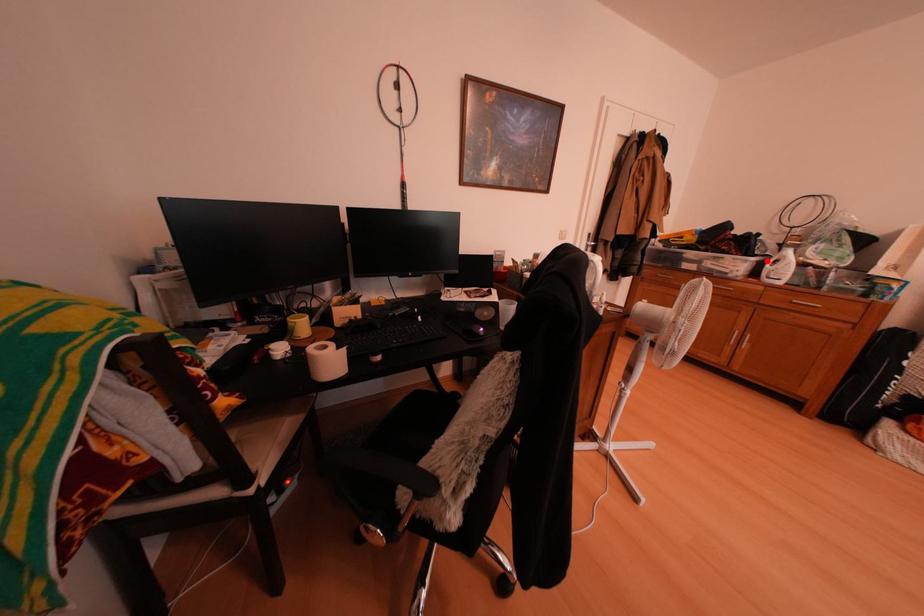
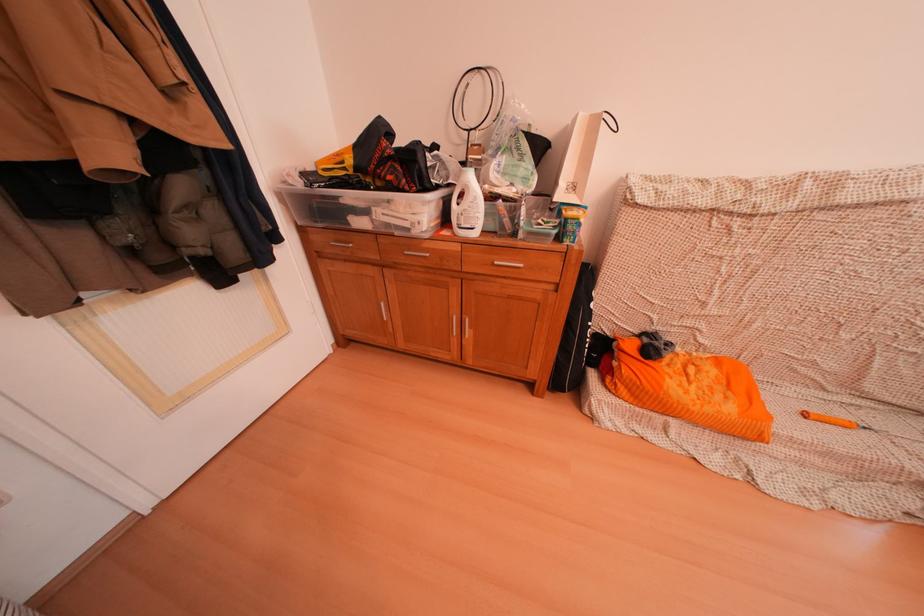
In the second image, find the point that corresponds to the highlighted location in the first image.

(450, 192)